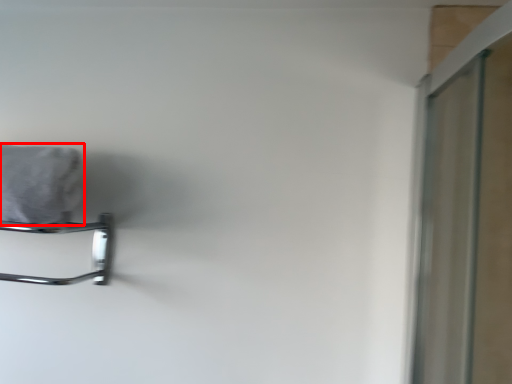
Question: Where is bath towel (annotated by the red box) located in relation to towel rack in the image?

Choices:
 (A) left
 (B) right

Answer: (A)